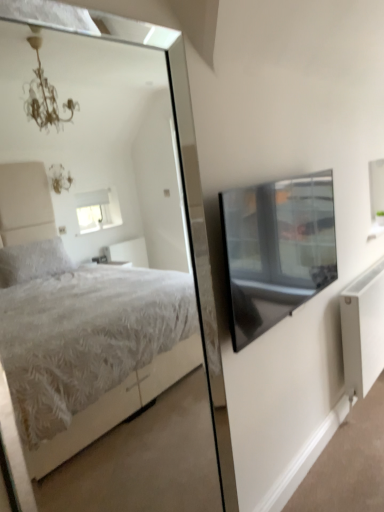
The width and height of the screenshot is (384, 512). Describe the element at coordinates (116, 406) in the screenshot. I see `white textured bed at center` at that location.

What is the approximate width of transparent glass window screen at upper right?

transparent glass window screen at upper right is 4.70 inches in width.

What do you see at coordinates (276, 249) in the screenshot? I see `transparent glass window screen at upper right` at bounding box center [276, 249].

Identify the location of white textured bed at center. This screenshot has height=512, width=384. (116, 406).

Is point (45, 465) in front of point (321, 285)?

No.

What's the angular difference between white textured bed at center and transparent glass window screen at upper right's facing directions?

1.1 degrees separate the facing orientations of white textured bed at center and transparent glass window screen at upper right.

Considering the relative positions of white textured bed at center and transparent glass window screen at upper right in the image provided, is white textured bed at center to the left or to the right of transparent glass window screen at upper right?

From the image, it's evident that white textured bed at center is to the left of transparent glass window screen at upper right.

In order to click on window screen behind the white textured bed at center in this screenshot , I will do `click(276, 249)`.

Locate an element on the screen. The width and height of the screenshot is (384, 512). radiator below the white textured bed at center (from the image's perspective) is located at coordinates (363, 330).

Between white textured bed at center and white matte radiator at lower right, which one has larger size?

With larger size is white matte radiator at lower right.

Is white textured bed at center turned away from white matte radiator at lower right?

white textured bed at center does not have its back to white matte radiator at lower right.

Is point (357, 335) in front of point (329, 273)?

No, it is not.

Would you consider white matte radiator at lower right to be distant from transparent glass window screen at upper right?

white matte radiator at lower right is actually quite close to transparent glass window screen at upper right.

From a real-world perspective, is white matte radiator at lower right positioned over transparent glass window screen at upper right based on gravity?

No, from a real-world perspective, white matte radiator at lower right is not above transparent glass window screen at upper right.

Could you measure the distance between white matte radiator at lower right and transparent glass window screen at upper right?

The distance of white matte radiator at lower right from transparent glass window screen at upper right is 69.20 centimeters.

Between white matte radiator at lower right and white textured bed at center, which one is positioned in front?

white textured bed at center is in front.

Between white matte radiator at lower right and white textured bed at center, which one appears on the right side from the viewer's perspective?

Positioned to the right is white matte radiator at lower right.

Considering the sizes of objects white matte radiator at lower right and white textured bed at center in the image provided, who is thinner, white matte radiator at lower right or white textured bed at center?

With smaller width is white textured bed at center.

Does white matte radiator at lower right contain white textured bed at center?

No, white textured bed at center is located outside of white matte radiator at lower right.

From a real-world perspective, is transparent glass window screen at upper right above or below white textured bed at center?

Clearly, from a real-world perspective, transparent glass window screen at upper right is above white textured bed at center.

Which is more to the left, transparent glass window screen at upper right or white textured bed at center?

Positioned to the left is white textured bed at center.

From the image's perspective, is transparent glass window screen at upper right on white textured bed at center?

Yes, from the image's perspective, transparent glass window screen at upper right is above white textured bed at center.

Considering the sizes of transparent glass window screen at upper right and white matte radiator at lower right in the image, is transparent glass window screen at upper right wider or thinner than white matte radiator at lower right?

In the image, transparent glass window screen at upper right appears to be more narrow than white matte radiator at lower right.

Is transparent glass window screen at upper right in contact with white matte radiator at lower right?

No, transparent glass window screen at upper right is not making contact with white matte radiator at lower right.

Between transparent glass window screen at upper right and white matte radiator at lower right, which one has less height?

Standing shorter between the two is transparent glass window screen at upper right.

What's the angular difference between transparent glass window screen at upper right and white matte radiator at lower right's facing directions?

The angle between the facing direction of transparent glass window screen at upper right and the facing direction of white matte radiator at lower right is 1.1 degrees.

Identify the location of window screen lying behind the white textured bed at center. The width and height of the screenshot is (384, 512). (276, 249).

Locate an element on the screen. The image size is (384, 512). bed in front of the white matte radiator at lower right is located at coordinates (116, 406).

Considering their positions, is white textured bed at center positioned closer to transparent glass window screen at upper right than white matte radiator at lower right?

white matte radiator at lower right is positioned closer to the anchor transparent glass window screen at upper right.

Estimate the real-world distances between objects in this image. Which object is further from white matte radiator at lower right, white textured bed at center or transparent glass window screen at upper right?

Based on the image, white textured bed at center appears to be further to white matte radiator at lower right.

Estimate the real-world distances between objects in this image. Which object is closer to white textured bed at center, transparent glass window screen at upper right or white matte radiator at lower right?

Based on the image, white matte radiator at lower right appears to be nearer to white textured bed at center.

Estimate the real-world distances between objects in this image. Which object is further from white matte radiator at lower right, transparent glass window screen at upper right or white textured bed at center?

white textured bed at center.

Considering their positions, is white matte radiator at lower right positioned further to transparent glass window screen at upper right than white textured bed at center?

white textured bed at center is positioned further to the anchor transparent glass window screen at upper right.

When comparing their distances from white textured bed at center, does white matte radiator at lower right or transparent glass window screen at upper right seem closer?

white matte radiator at lower right is closer to white textured bed at center.

At what (x,y) coordinates should I click in order to perform the action: click on window screen positioned between white textured bed at center and white matte radiator at lower right from near to far. Please return your answer as a coordinate pair (x, y). This screenshot has width=384, height=512. Looking at the image, I should click on (276, 249).